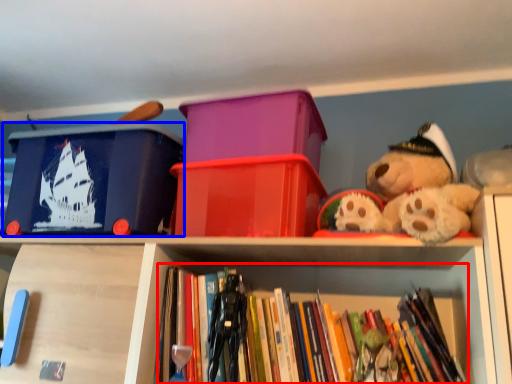
Question: Which of the following is the closest to the observer, book (highlighted by a red box) or storage box (highlighted by a blue box)?

Choices:
 (A) book
 (B) storage box

Answer: (A)